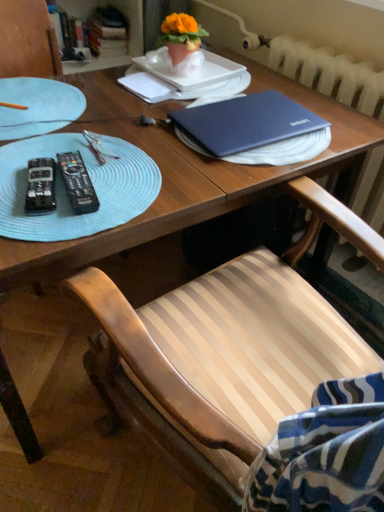
The height and width of the screenshot is (512, 384). I want to click on vacant space that's between black plastic remote control at left, the first remote control viewed from the right, and white paper at upper center, so click(x=120, y=133).